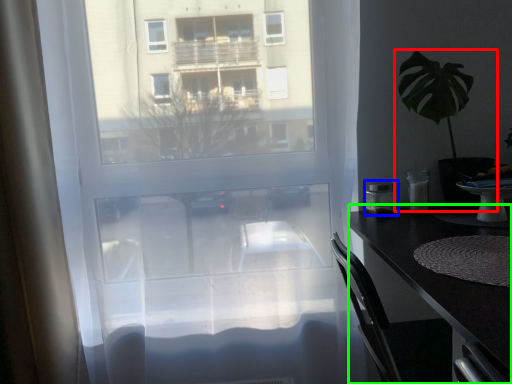
Question: Estimate the real-world distances between objects in this image. Which object is closer to houseplant (highlighted by a red box), appliance (highlighted by a blue box) or desk (highlighted by a green box)?

Choices:
 (A) appliance
 (B) desk

Answer: (A)